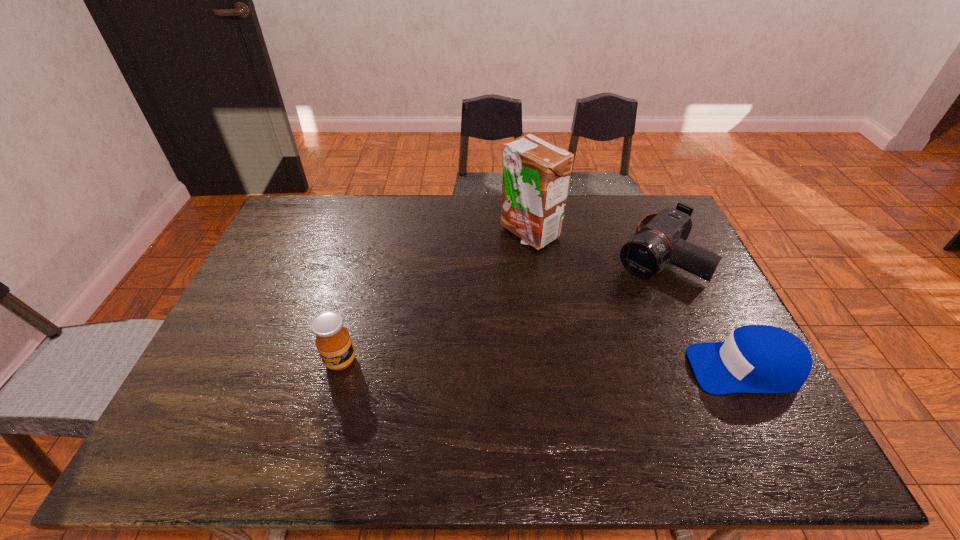
Find the location of `free region located 0.060m on the straw side of the second object from left to right`. free region located 0.060m on the straw side of the second object from left to right is located at coordinates (526, 265).

This screenshot has height=540, width=960. In order to click on vacant space located on the straw side of the second object from left to right in this screenshot , I will do `click(527, 263)`.

Locate an element on the screen. Image resolution: width=960 pixels, height=540 pixels. vacant point located 0.140m on the straw side of the second object from left to right is located at coordinates (525, 282).

Find the location of a particular element. The height and width of the screenshot is (540, 960). vacant region located on the lens of the camcorder is located at coordinates (598, 313).

Where is `free region located on the lens of the camcorder`? This screenshot has width=960, height=540. free region located on the lens of the camcorder is located at coordinates (616, 295).

The height and width of the screenshot is (540, 960). Find the location of `free spot located on the lens of the camcorder`. free spot located on the lens of the camcorder is located at coordinates (588, 323).

Image resolution: width=960 pixels, height=540 pixels. Identify the location of carton present at the far edge. (536, 174).

Image resolution: width=960 pixels, height=540 pixels. I want to click on camcorder situated at the far edge, so coord(659,236).

The image size is (960, 540). What are the coordinates of `object that is at the near edge` in the screenshot? It's located at (755, 358).

What are the coordinates of `baseball cap positioned at the right edge` in the screenshot? It's located at (755, 358).